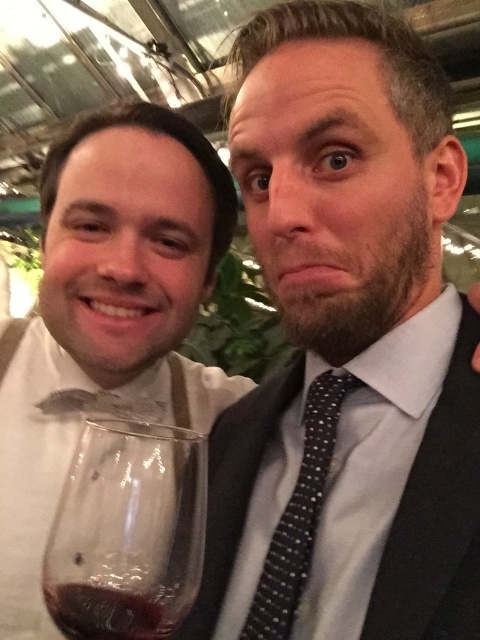
You are a photographer adjusting the camera focus. The camera is currently focused on the individual on the right. The matte white bow tie at left is located at point 0.497, 0.223. To ensure the bow tie is in focus, should you adjust the focus to a higher or lower value?

The matte white bow tie at left is positioned at point (107, 317), so you should adjust the focus to a higher value to bring it into focus since it is further away from the current focus point on the right individual.

You are a photographer at a social event and need to ensure that both the black textured suit at center and the black dotted tie at center are clearly visible in your photo. Given their sizes, which one might require more careful framing to avoid being obscured?

The black dotted tie at center is smaller in size than the black textured suit at center, so it might require more careful framing to avoid being obscured.

You are at a formal event and need to take a photo with two people. You notice the matte white bow tie at left and the black textured suit at center. Based on their positions, which one is closer to the camera?

The matte white bow tie at left is closer to the camera because the black textured suit at center is behind it.